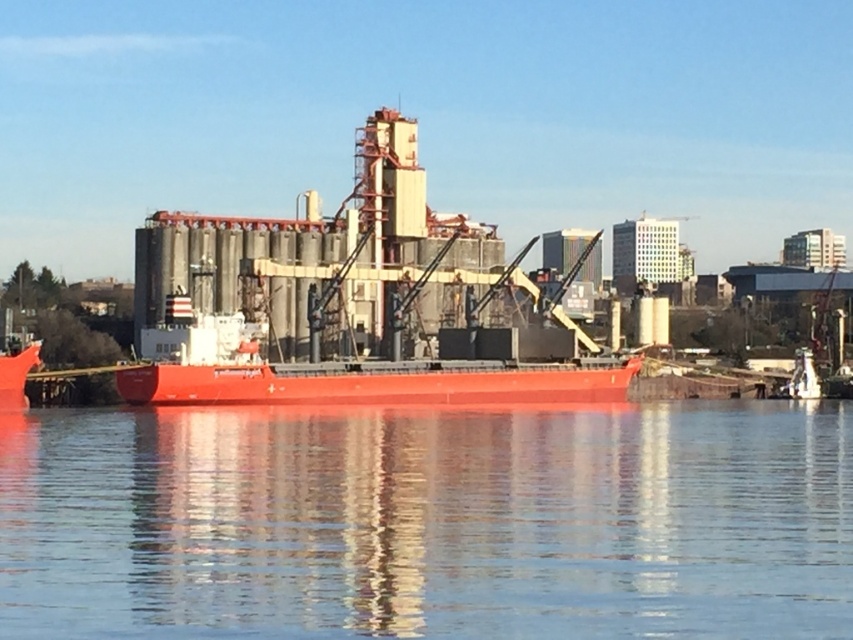
Between smooth water at lower center and smooth red ship at center, which one appears on the right side from the viewer's perspective?

From the viewer's perspective, smooth water at lower center appears more on the right side.

Is point (666, 620) positioned after point (265, 397)?

No, (666, 620) is closer to viewer.

Which is in front, point (387, 445) or point (166, 380)?

Positioned in front is point (387, 445).

You are a GUI agent. You are given a task and a screenshot of the screen. Output one action in this format:
    pyautogui.click(x=<x>, y=<y>)
    Task: Click on the smooth water at lower center
    The width and height of the screenshot is (853, 640).
    Given the screenshot: What is the action you would take?
    pyautogui.click(x=428, y=522)